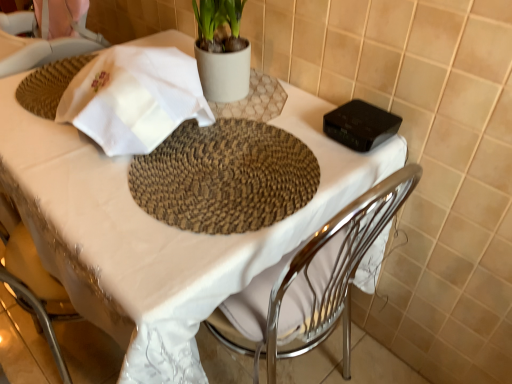
At what (x,y) coordinates should I click in order to perform the action: click on free space above white fabric table at center (from a real-world perspective). Please return your answer as a coordinate pair (x, y). The height and width of the screenshot is (384, 512). Looking at the image, I should click on tap(174, 149).